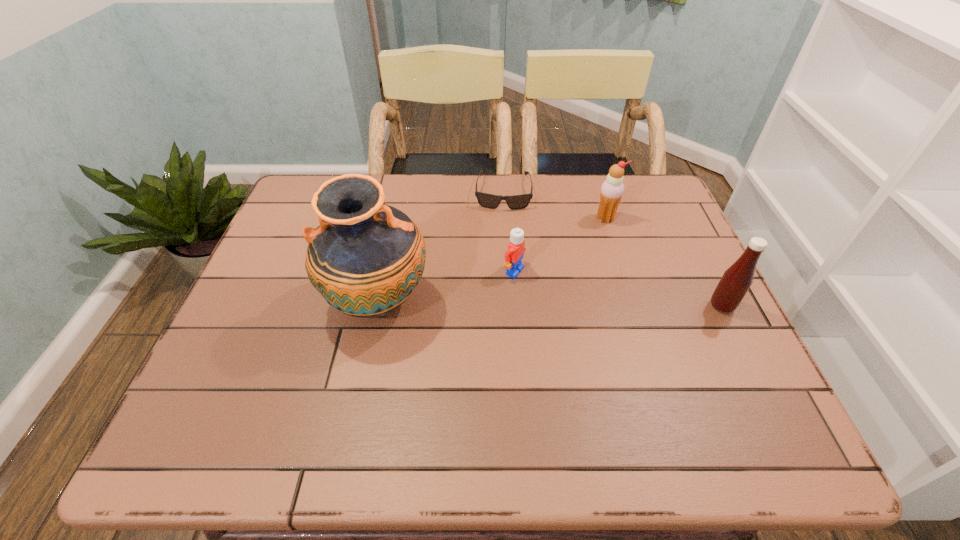
The image size is (960, 540). Identify the location of vacant spot on the desktop that is between the pottery and the rightmost object and is positioned at the front with a straw on the fourth object from left to right. (598, 304).

I want to click on vacant space on the desktop that is between the pottery and the rightmost object and is positioned on the face of the fourth tallest object, so click(x=592, y=304).

I want to click on free space on the desktop that is between the tallest object and the Tabasco sauce and is positioned on the front-facing side of the shortest object, so click(x=498, y=303).